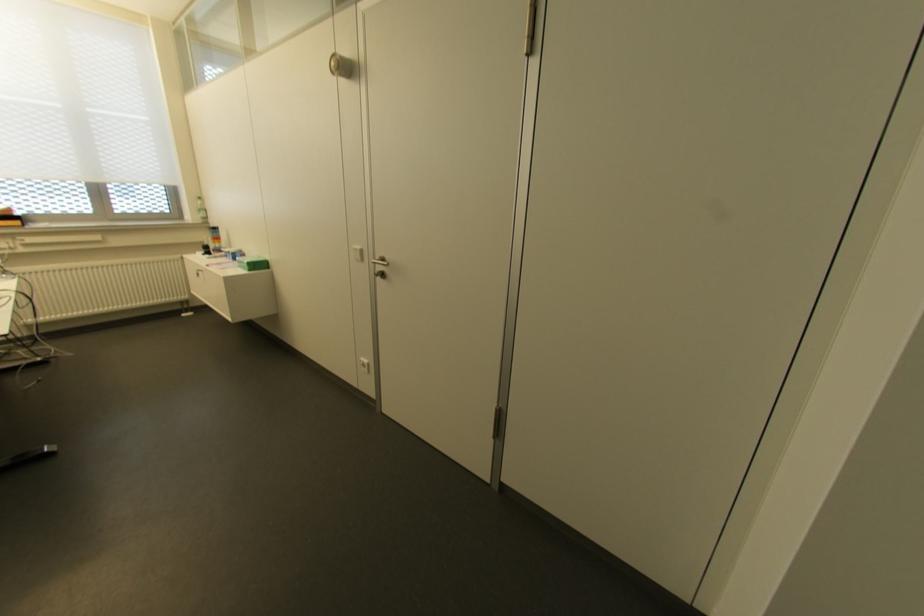
The location [252,262] corresponds to which object?

It corresponds to the green cardboard box in the image.